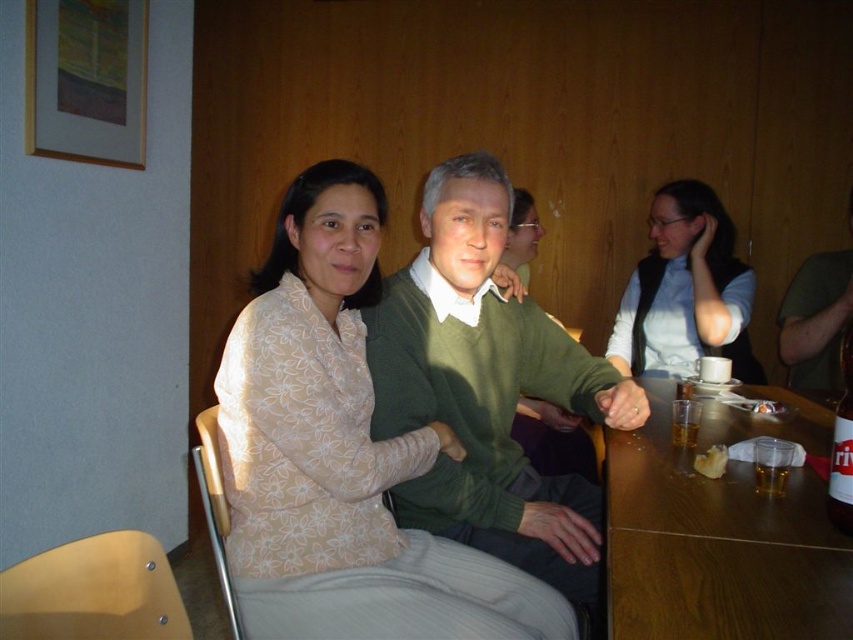
Which is more to the left, translucent plastic cup at table right or translucent glass beer at table right?

translucent glass beer at table right is more to the left.

Describe the element at coordinates (770, 477) in the screenshot. The image size is (853, 640). I see `translucent plastic cup at table right` at that location.

The width and height of the screenshot is (853, 640). What do you see at coordinates (770, 477) in the screenshot?
I see `translucent plastic cup at table right` at bounding box center [770, 477].

This screenshot has width=853, height=640. Find the location of `translucent plastic cup at table right`. translucent plastic cup at table right is located at coordinates (770, 477).

Is point (407, 296) positioned in front of point (756, 460)?

No, it is not.

Can you confirm if green sweater at center is thinner than translucent plastic cup at table right?

In fact, green sweater at center might be wider than translucent plastic cup at table right.

Does point (601, 538) come closer to viewer compared to point (757, 490)?

No, (601, 538) is behind (757, 490).

In order to click on green sweater at center in this screenshot , I will do click(x=488, y=388).

Is wooden table at lower right further to the viewer compared to translucent glass beer at table right?

No, it is not.

Which is behind, point (772, 541) or point (672, 435)?

The point (672, 435) is more distant.

Does point (729, 568) come behind point (679, 422)?

No, (729, 568) is in front of (679, 422).

At what (x,y) coordinates should I click in order to perform the action: click on wooden table at lower right. Please return your answer as a coordinate pair (x, y). The width and height of the screenshot is (853, 640). Looking at the image, I should click on (715, 545).